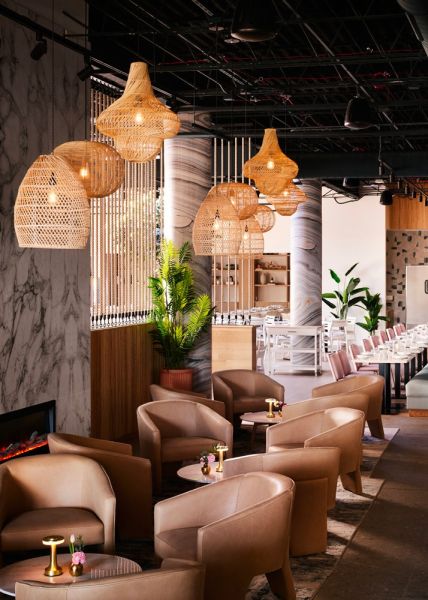
Find the location of a particular element. The image size is (428, 600). round chair is located at coordinates (156, 580), (258, 512), (56, 483), (113, 456), (184, 435), (322, 424), (360, 391), (254, 389).